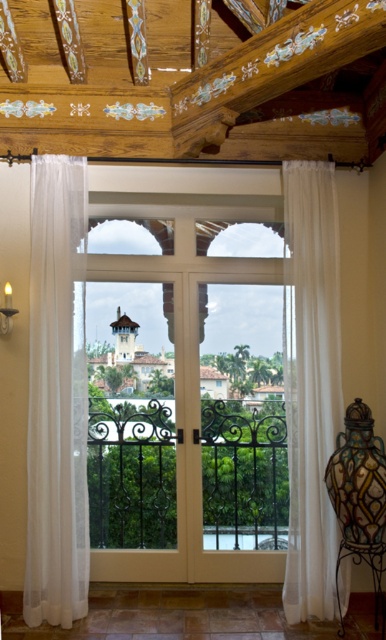
You are a decorator trying to place a decorative 3.5 feet wide shelf between the white sheer curtains at center and the sheer white curtain at left. Can the shelf fit in the space between them?

The distance between the white sheer curtains at center and the sheer white curtain at left is 3.58 feet, so the 3.5 feet wide shelf can fit in the space between them since it is slightly narrower than the available space.

You are standing inside the room and want to see through the white wood screen door at center. Can you see the view outside the door through the white sheer curtains at center?

The white sheer curtains at center is shorter than white wood screen door at center, so yes, you can see the view outside the door through the white sheer curtains at center because they do not fully cover the door.